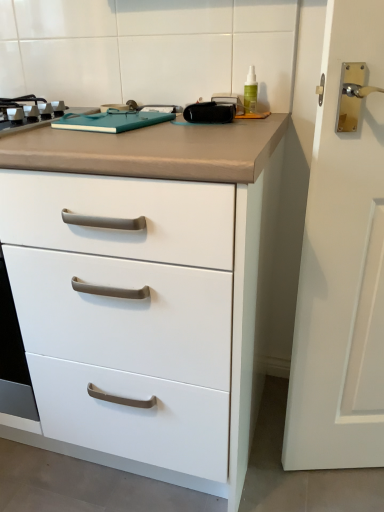
This screenshot has height=512, width=384. What do you see at coordinates (140, 289) in the screenshot? I see `white matte chest of drawers at center` at bounding box center [140, 289].

Measure the distance between green translucent bottle at upper right and camera.

green translucent bottle at upper right and camera are 1.09 meters apart.

Locate an element on the screen. The height and width of the screenshot is (512, 384). white matte chest of drawers at center is located at coordinates click(x=140, y=289).

Choose the correct answer: Is metallic gray gas stove at upper left inside white matte chest of drawers at center or outside it?

metallic gray gas stove at upper left is inside white matte chest of drawers at center.

How much distance is there between metallic gray gas stove at upper left and white matte chest of drawers at center?

metallic gray gas stove at upper left and white matte chest of drawers at center are 18.42 inches apart.

I want to click on chest of drawers below the metallic gray gas stove at upper left (from a real-world perspective), so click(140, 289).

Can you confirm if metallic gray gas stove at upper left is thinner than white matte chest of drawers at center?

Indeed, metallic gray gas stove at upper left has a lesser width compared to white matte chest of drawers at center.

From a real-world perspective, which object stands above the other?

green translucent bottle at upper right.

How far apart are metallic gray gas stove at upper left and green translucent bottle at upper right?

metallic gray gas stove at upper left and green translucent bottle at upper right are 20.48 inches apart from each other.

This screenshot has height=512, width=384. I want to click on gas stove on the left side of green translucent bottle at upper right, so click(x=36, y=115).

From the image's perspective, is metallic gray gas stove at upper left under green translucent bottle at upper right?

Yes, from the image's perspective, metallic gray gas stove at upper left is below green translucent bottle at upper right.

From a real-world perspective, does green translucent bottle at upper right stand above metallic gray gas stove at upper left?

Yes, from a real-world perspective, green translucent bottle at upper right is above metallic gray gas stove at upper left.

Is point (250, 108) closer to viewer compared to point (42, 108)?

No, (250, 108) is further to viewer.

Does green translucent bottle at upper right have a smaller size compared to metallic gray gas stove at upper left?

Yes.

Is green translucent bottle at upper right to the left or to the right of metallic gray gas stove at upper left in the image?

Based on their positions, green translucent bottle at upper right is located to the right of metallic gray gas stove at upper left.

Does green translucent bottle at upper right lie behind white matte chest of drawers at center?

Yes, green translucent bottle at upper right is further from the camera.

Which is in front, point (250, 90) or point (247, 248)?

Positioned in front is point (247, 248).

Considering the positions of objects green translucent bottle at upper right and white matte chest of drawers at center in the image provided, who is more to the right, green translucent bottle at upper right or white matte chest of drawers at center?

From the viewer's perspective, green translucent bottle at upper right appears more on the right side.

Can we say white matte chest of drawers at center lies outside green translucent bottle at upper right?

Yes, white matte chest of drawers at center is outside of green translucent bottle at upper right.

Is white matte chest of drawers at center far from green translucent bottle at upper right?

white matte chest of drawers at center is actually quite close to green translucent bottle at upper right.

At what (x,y) coordinates should I click in order to perform the action: click on chest of drawers below the green translucent bottle at upper right (from the image's perspective). Please return your answer as a coordinate pair (x, y). The image size is (384, 512). Looking at the image, I should click on (140, 289).

Can you tell me how much white matte chest of drawers at center and green translucent bottle at upper right differ in facing direction?

white matte chest of drawers at center and green translucent bottle at upper right are facing 4.12 degrees away from each other.

Can you confirm if white matte chest of drawers at center is bigger than metallic gray gas stove at upper left?

Yes.

From the image's perspective, does white matte chest of drawers at center appear higher than metallic gray gas stove at upper left?

No.

Is white matte chest of drawers at center inside the boundaries of metallic gray gas stove at upper left, or outside?

white matte chest of drawers at center exists outside the volume of metallic gray gas stove at upper left.

From a real-world perspective, between white matte chest of drawers at center and metallic gray gas stove at upper left, who is vertically lower?

white matte chest of drawers at center, from a real-world perspective.

Locate an element on the screen. The image size is (384, 512). chest of drawers in front of the metallic gray gas stove at upper left is located at coordinates (140, 289).

At what (x,y) coordinates should I click in order to perform the action: click on bottle above the metallic gray gas stove at upper left (from the image's perspective). Please return your answer as a coordinate pair (x, y). Image resolution: width=384 pixels, height=512 pixels. Looking at the image, I should click on (250, 92).

Considering their positions, is green translucent bottle at upper right positioned further to metallic gray gas stove at upper left than white matte chest of drawers at center?

green translucent bottle at upper right lies further to metallic gray gas stove at upper left than the other object.

When comparing their distances from green translucent bottle at upper right, does metallic gray gas stove at upper left or white matte chest of drawers at center seem further?

Based on the image, white matte chest of drawers at center appears to be further to green translucent bottle at upper right.

When comparing their distances from white matte chest of drawers at center, does metallic gray gas stove at upper left or green translucent bottle at upper right seem further?

Among the two, green translucent bottle at upper right is located further to white matte chest of drawers at center.

Which object lies nearer to the anchor point metallic gray gas stove at upper left, white matte chest of drawers at center or green translucent bottle at upper right?

white matte chest of drawers at center lies closer to metallic gray gas stove at upper left than the other object.

Which object lies nearer to the anchor point green translucent bottle at upper right, white matte chest of drawers at center or metallic gray gas stove at upper left?

metallic gray gas stove at upper left lies closer to green translucent bottle at upper right than the other object.

Based on their spatial positions, is green translucent bottle at upper right or metallic gray gas stove at upper left closer to white matte chest of drawers at center?

metallic gray gas stove at upper left.

I want to click on the chest of drawers situated between metallic gray gas stove at upper left and green translucent bottle at upper right from left to right, so click(140, 289).